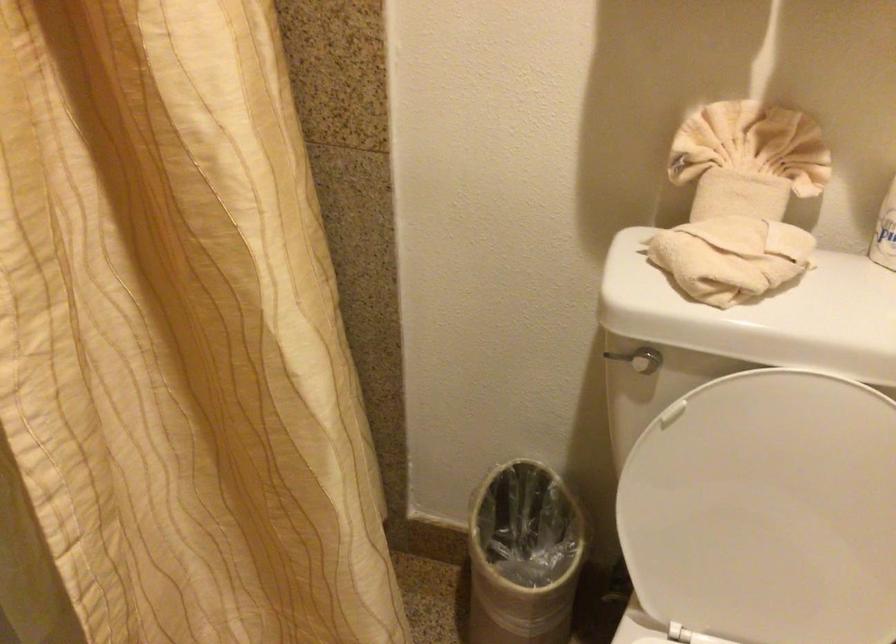
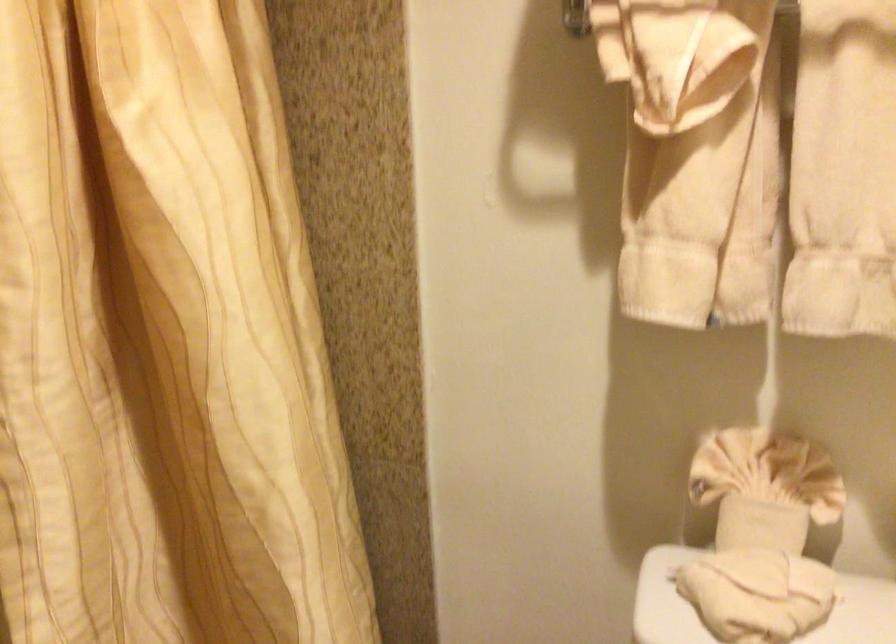
Question: How did the camera likely rotate?

Choices:
 (A) Left
 (B) Right
 (C) Up
 (D) Down

Answer: (C)